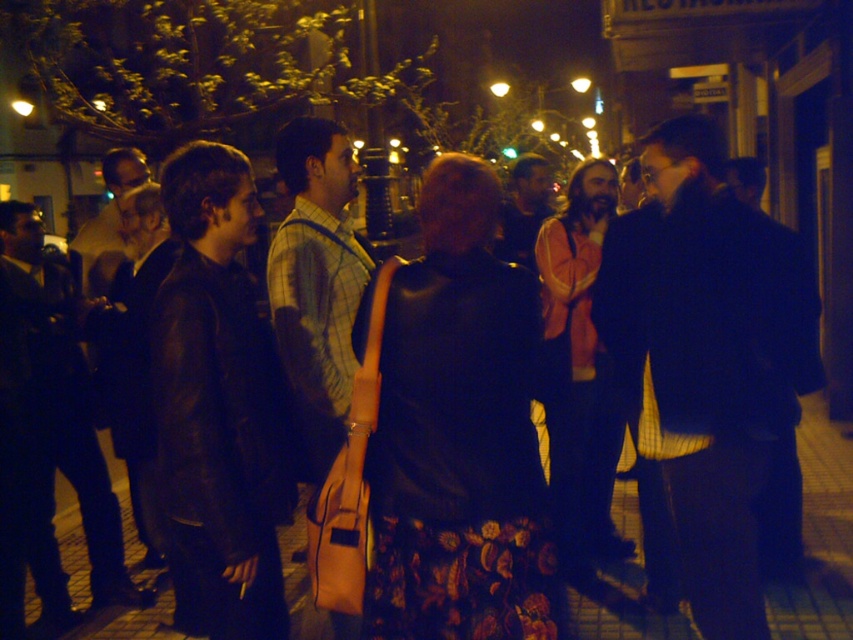
You are a photographer trying to capture a group photo of the plaid fabric shirt at center and the dark brown leather jacket at left. Since you want both subjects to appear equally sized in the photo, which subject should you move closer to the camera?

You should move closer to the plaid fabric shirt at center because it has a smaller size compared to the dark brown leather jacket at left, so moving it closer will make it appear larger in the photo and balance the sizes.

You are a photographer trying to capture a candid shot of the plaid fabric shirt at center without including the leather jacket at left in the frame. Based on their positions, is this possible?

The leather jacket at left is closer to the viewer than the plaid fabric shirt at center, so it would block the view of the plaid fabric shirt at center. Therefore, it is not possible to capture the plaid fabric shirt at center without including the leather jacket at left in the frame.